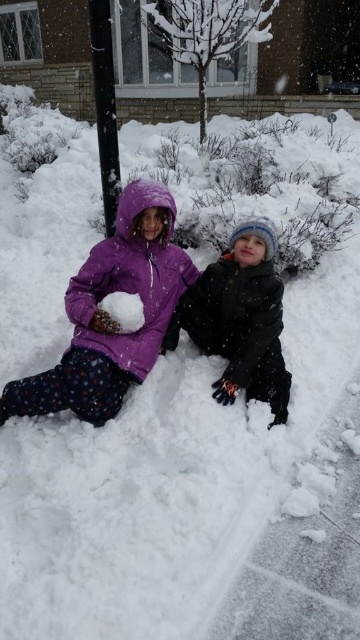
You are a photographer trying to capture both the black woolen hat at center and the black smooth pole at upper center in a single frame. Which object should you focus on first to ensure both are in the frame?

You should focus on the black woolen hat at center first because it is larger in size compared to the black smooth pole at upper center, ensuring it fits within the frame while the smaller pole remains visible.

You are a parent trying to ensure your child stays within a safe distance from the pole. The safe distance is set to 5 feet. Based on the scene, can the child wearing the black woolen hat at center safely approach the black smooth pole at upper center without violating the safety rule?

The distance between the black woolen hat at center and the black smooth pole at upper center is 5.37 feet, which exceeds the 5 feet safety rule. Therefore, the child can approach closer by 0.37 feet before reaching the minimum safe distance.